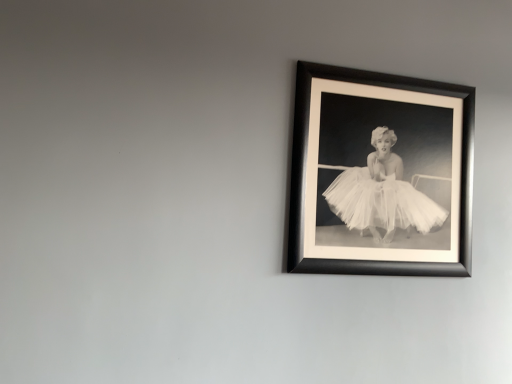
The width and height of the screenshot is (512, 384). Describe the element at coordinates (380, 174) in the screenshot. I see `black matte picture frame at upper right` at that location.

You are a GUI agent. You are given a task and a screenshot of the screen. Output one action in this format:
    pyautogui.click(x=<x>, y=<y>)
    Task: Click on the black matte picture frame at upper right
    This screenshot has width=512, height=384.
    Given the screenshot: What is the action you would take?
    pyautogui.click(x=380, y=174)

Where is `black matte picture frame at upper right`? The image size is (512, 384). black matte picture frame at upper right is located at coordinates (380, 174).